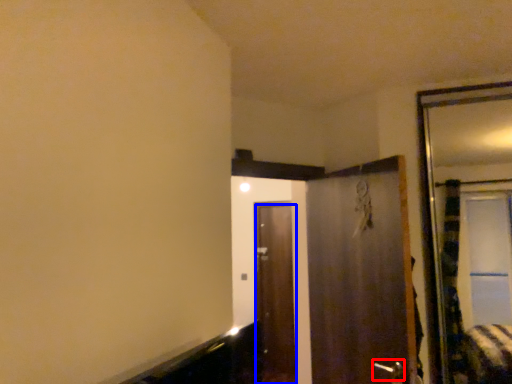
Question: Among these objects, which one is nearest to the camera, door handle (highlighted by a red box) or door (highlighted by a blue box)?

Choices:
 (A) door handle
 (B) door

Answer: (A)